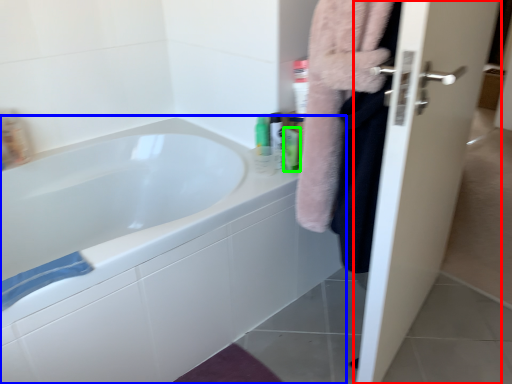
Question: Which is nearer to the door (highlighted by a red box)? bathtub (highlighted by a blue box) or mouthwash (highlighted by a green box).

Choices:
 (A) bathtub
 (B) mouthwash

Answer: (A)